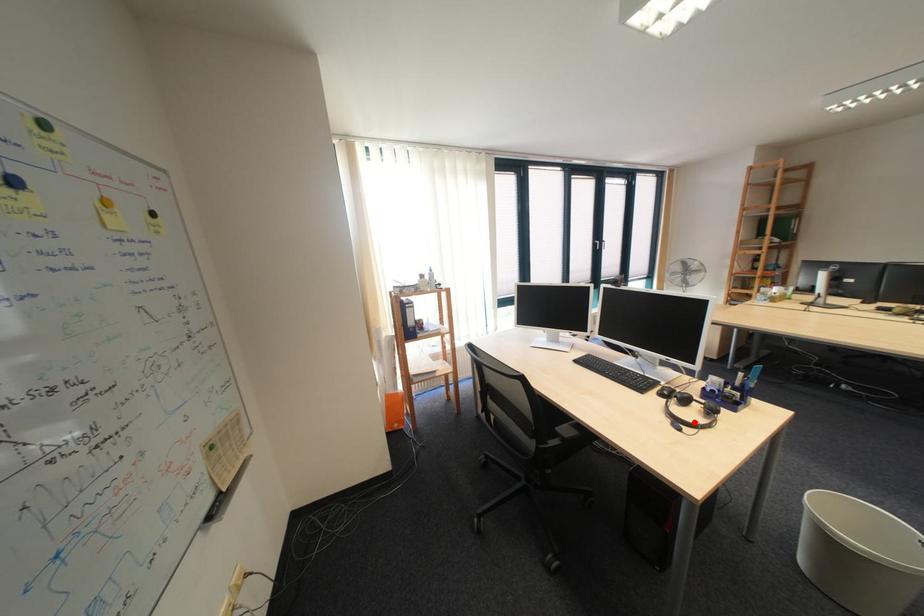
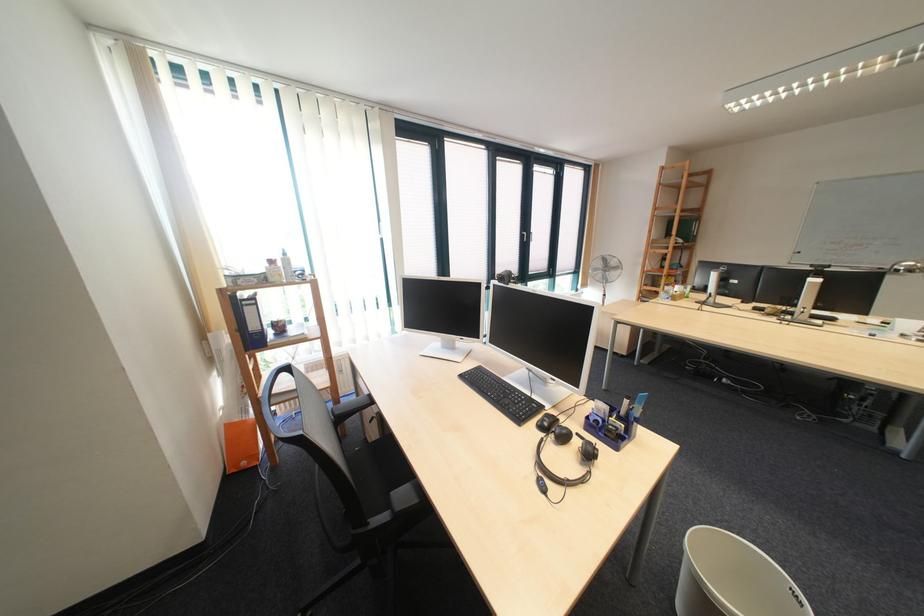
The point at the highlighted location is marked in the first image. Where is the corresponding point in the second image?

(563, 476)